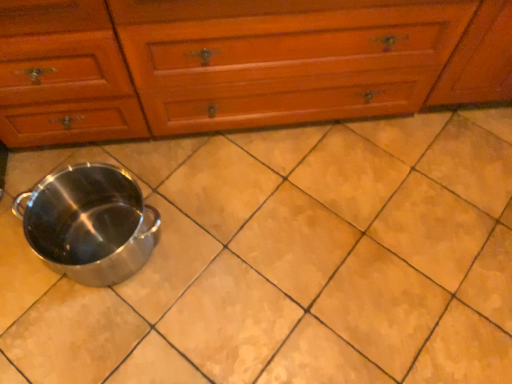
Where is `vacant point to the right of satin silver crock pot at lower left`? The image size is (512, 384). vacant point to the right of satin silver crock pot at lower left is located at coordinates (209, 256).